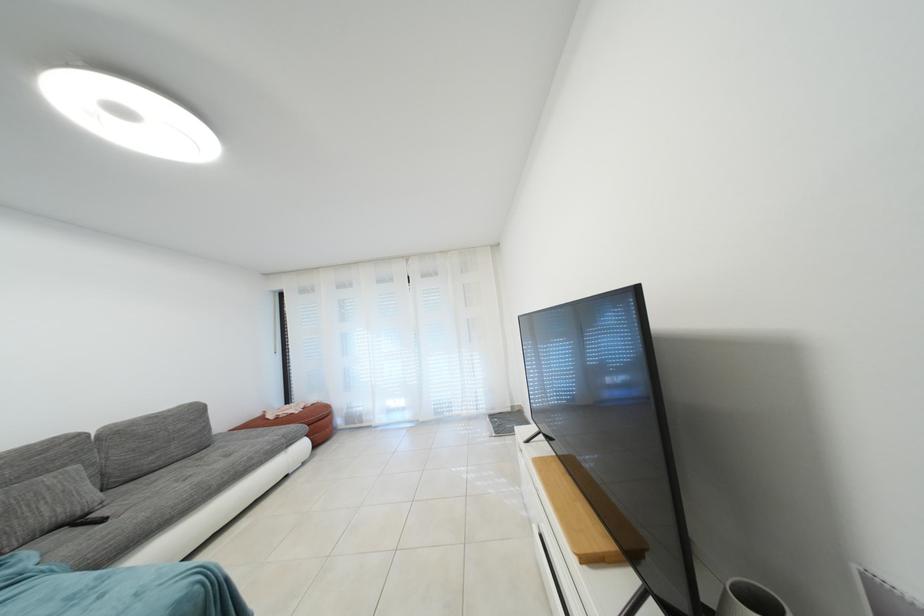
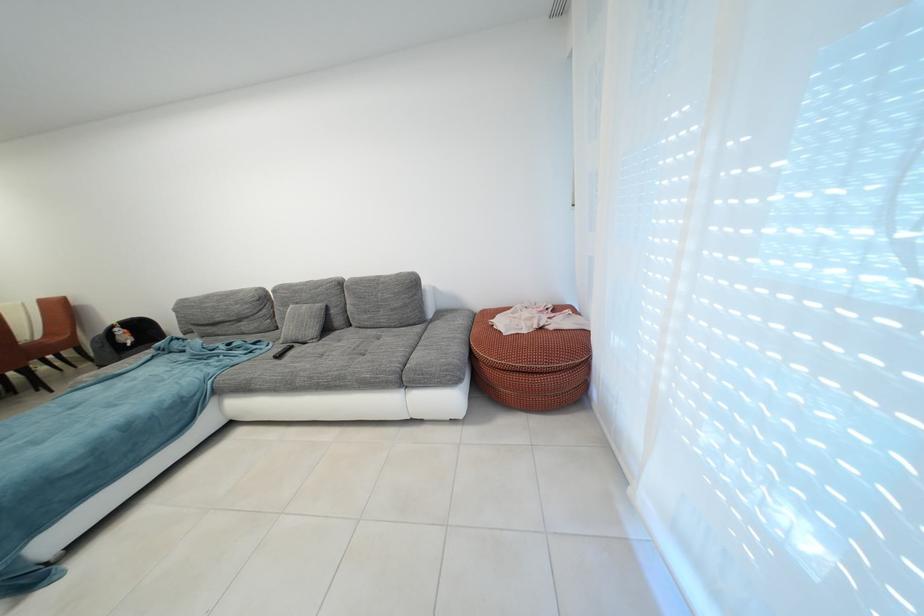
Locate, in the second image, the point that corresponds to (110,525) in the first image.

(287, 361)